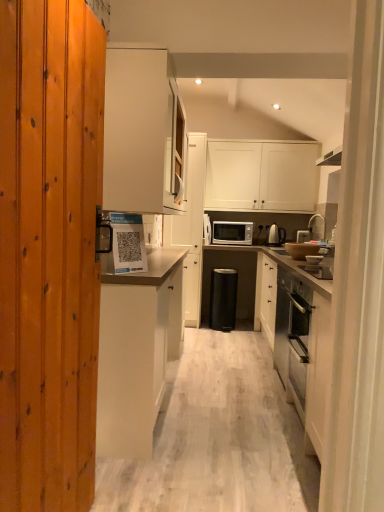
Measure the distance between black plastic trash bin at center and camera.

The distance of black plastic trash bin at center from camera is 14.47 feet.

This screenshot has width=384, height=512. I want to click on white glossy cabinet at upper center, which is the 3th cabinetry in left-to-right order, so click(x=191, y=228).

Image resolution: width=384 pixels, height=512 pixels. What do you see at coordinates (317, 227) in the screenshot?
I see `silver metallic faucet at upper right` at bounding box center [317, 227].

Find the location of `silver metallic faucet at upper right`. silver metallic faucet at upper right is located at coordinates (317, 227).

Based on the photo, measure the distance between point (122, 283) and camera.

A distance of 6.52 feet exists between point (122, 283) and camera.

Identify the location of matte silver teapot at right. (275, 234).

Can you tell me how much white glossy microwave oven at center and white matte cabinet at center, marked as the 1th cabinetry in a left-to-right arrangement, differ in facing direction?

88.8 degrees separate the facing orientations of white glossy microwave oven at center and white matte cabinet at center, marked as the 1th cabinetry in a left-to-right arrangement.

Does white glossy microwave oven at center turn towards white matte cabinet at center, which is counted as the 4th cabinetry, starting from the right?

Yes, white glossy microwave oven at center is turned towards white matte cabinet at center, which is counted as the 4th cabinetry, starting from the right.

From the image's perspective, is white glossy microwave oven at center located above white matte cabinet at center, marked as the 1th cabinetry in a left-to-right arrangement?

Indeed, from the image's perspective, white glossy microwave oven at center is shown above white matte cabinet at center, marked as the 1th cabinetry in a left-to-right arrangement.

Which is correct: white glossy microwave oven at center is inside white matte cabinet at center, which is counted as the 4th cabinetry, starting from the right, or outside of it?

white glossy microwave oven at center cannot be found inside white matte cabinet at center, which is counted as the 4th cabinetry, starting from the right.

Could you tell me if white matte cabinet at center, which is counted as the 4th cabinetry, starting from the right, is facing white glossy microwave oven at center?

No, white matte cabinet at center, which is counted as the 4th cabinetry, starting from the right, is not aimed at white glossy microwave oven at center.

At what (x,y) coordinates should I click in order to perform the action: click on microwave oven above the white matte cabinet at center, marked as the 1th cabinetry in a left-to-right arrangement (from the image's perspective). Please return your answer as a coordinate pair (x, y). Image resolution: width=384 pixels, height=512 pixels. Looking at the image, I should click on (232, 233).

Could you measure the distance between white matte cabinet at center, marked as the 1th cabinetry in a left-to-right arrangement, and white glossy microwave oven at center?

white matte cabinet at center, marked as the 1th cabinetry in a left-to-right arrangement, and white glossy microwave oven at center are 7.78 feet apart from each other.

Considering the positions of point (97, 440) and point (228, 234), is point (97, 440) closer or farther from the camera than point (228, 234)?

Point (97, 440) is positioned closer to the camera compared to point (228, 234).

Where is `faucet below the white glossy cabinet at upper center, which is the 3th cabinetry in left-to-right order (from the image's perspective)`? faucet below the white glossy cabinet at upper center, which is the 3th cabinetry in left-to-right order (from the image's perspective) is located at coordinates (317, 227).

Do you think silver metallic faucet at upper right is within white glossy cabinet at upper center, which is the 3th cabinetry in left-to-right order, or outside of it?

silver metallic faucet at upper right cannot be found inside white glossy cabinet at upper center, which is the 3th cabinetry in left-to-right order.

Does silver metallic faucet at upper right turn towards white glossy cabinet at upper center, which is the 3th cabinetry in left-to-right order?

No, silver metallic faucet at upper right is not facing towards white glossy cabinet at upper center, which is the 3th cabinetry in left-to-right order.

From a real-world perspective, which object rests below the other?

white glossy cabinet at upper center, which is the 3th cabinetry in left-to-right order, is physically lower.

Could you measure the distance between white glossy microwave oven at center and white matte cabinet at upper center, which appears as the 4th cabinetry when viewed from the left?

The distance of white glossy microwave oven at center from white matte cabinet at upper center, which appears as the 4th cabinetry when viewed from the left, is 21.77 inches.

Between white glossy microwave oven at center and white matte cabinet at upper center, which appears as the 4th cabinetry when viewed from the left, which one has more height?

white matte cabinet at upper center, which appears as the 4th cabinetry when viewed from the left.

Where is `microwave oven that is on the left side of white matte cabinet at upper center, acting as the 1th cabinetry starting from the right`? Image resolution: width=384 pixels, height=512 pixels. microwave oven that is on the left side of white matte cabinet at upper center, acting as the 1th cabinetry starting from the right is located at coordinates (232, 233).

Which is behind, white glossy microwave oven at center or white matte cabinet at upper center, which appears as the 4th cabinetry when viewed from the left?

white glossy microwave oven at center is further away from the camera.

This screenshot has height=512, width=384. Identify the location of appliance below the white matte cabinet at upper center, acting as the 1th cabinetry starting from the right (from a real-world perspective). (302, 236).

From a real-world perspective, is satin silver toaster at center under white matte cabinet at upper center, which appears as the 4th cabinetry when viewed from the left?

Correct, in the physical world, satin silver toaster at center is lower than white matte cabinet at upper center, which appears as the 4th cabinetry when viewed from the left.

Between point (299, 238) and point (290, 181), which one is positioned behind?

Positioned behind is point (290, 181).

Consider the image. Could white matte cabinet at upper center, which appears as the 4th cabinetry when viewed from the left, be considered to be inside satin silver toaster at center?

No, white matte cabinet at upper center, which appears as the 4th cabinetry when viewed from the left, is not a part of satin silver toaster at center.

Is white matte cabinet at upper center, which appears as the 4th cabinetry when viewed from the left, wider than silver metallic faucet at upper right?

Yes, white matte cabinet at upper center, which appears as the 4th cabinetry when viewed from the left, is wider than silver metallic faucet at upper right.

Is silver metallic faucet at upper right a part of white matte cabinet at upper center, acting as the 1th cabinetry starting from the right?

No, silver metallic faucet at upper right is not inside white matte cabinet at upper center, acting as the 1th cabinetry starting from the right.

From the image's perspective, between white matte cabinet at upper center, which appears as the 4th cabinetry when viewed from the left, and silver metallic faucet at upper right, which one is located above?

white matte cabinet at upper center, which appears as the 4th cabinetry when viewed from the left, is shown above in the image.

Which is in front, point (313, 200) or point (323, 238)?

The point (323, 238) is closer to the camera.

How many degrees apart are the facing directions of silver metallic faucet at upper right and matte silver teapot at right?

The facing directions of silver metallic faucet at upper right and matte silver teapot at right are 90.2 degrees apart.

Between silver metallic faucet at upper right and matte silver teapot at right, which one appears on the right side from the viewer's perspective?

silver metallic faucet at upper right.

Which of these two, silver metallic faucet at upper right or matte silver teapot at right, is wider?

silver metallic faucet at upper right.

Where is `cabinetry below the white glossy microwave oven at center (from the image's perspective)`? This screenshot has height=512, width=384. cabinetry below the white glossy microwave oven at center (from the image's perspective) is located at coordinates (137, 350).

I want to click on microwave oven located behind the white matte cabinet at center, which is counted as the 4th cabinetry, starting from the right, so click(x=232, y=233).

When comparing their distances from white matte cabinet at upper center, acting as the 1th cabinetry starting from the right, does satin silver toaster at center or silver metallic faucet at upper right seem closer?

The object closer to white matte cabinet at upper center, acting as the 1th cabinetry starting from the right, is silver metallic faucet at upper right.

Estimate the real-world distances between objects in this image. Which object is closer to matte silver teapot at right, white matte cabinet at upper center, acting as the 1th cabinetry starting from the right, or white matte cabinet at upper center, the 2th cabinetry positioned from the left?

white matte cabinet at upper center, acting as the 1th cabinetry starting from the right, is closer to matte silver teapot at right.

Looking at this image, considering their positions, is white matte cabinet at center, which is counted as the 4th cabinetry, starting from the right, positioned further to silver metallic faucet at upper right than matte silver teapot at right?

The object further to silver metallic faucet at upper right is white matte cabinet at center, which is counted as the 4th cabinetry, starting from the right.

Estimate the real-world distances between objects in this image. Which object is closer to white matte cabinet at center, which is counted as the 4th cabinetry, starting from the right, white glossy microwave oven at center or white glossy cabinet at upper center, arranged as the 2th cabinetry when viewed from the right?

white glossy cabinet at upper center, arranged as the 2th cabinetry when viewed from the right, is positioned closer to the anchor white matte cabinet at center, which is counted as the 4th cabinetry, starting from the right.

When comparing their distances from white glossy cabinet at upper center, arranged as the 2th cabinetry when viewed from the right, does black plastic trash bin at center or white matte cabinet at center, which is counted as the 4th cabinetry, starting from the right, seem closer?

Based on the image, black plastic trash bin at center appears to be nearer to white glossy cabinet at upper center, arranged as the 2th cabinetry when viewed from the right.

In the scene shown: Considering their positions, is white glossy microwave oven at center positioned further to matte silver teapot at right than white matte cabinet at center, which is counted as the 4th cabinetry, starting from the right?

The object further to matte silver teapot at right is white matte cabinet at center, which is counted as the 4th cabinetry, starting from the right.

Considering their positions, is white matte cabinet at upper center, acting as the 1th cabinetry starting from the right, positioned further to black plastic trash bin at center than white glossy cabinet at upper center, which is the 3th cabinetry in left-to-right order?

white matte cabinet at upper center, acting as the 1th cabinetry starting from the right, is further to black plastic trash bin at center.

Based on the photo, estimate the real-world distances between objects in this image. Which object is closer to white matte cabinet at center, marked as the 1th cabinetry in a left-to-right arrangement, satin silver toaster at center or white glossy microwave oven at center?

white glossy microwave oven at center is closer to white matte cabinet at center, marked as the 1th cabinetry in a left-to-right arrangement.

You are a GUI agent. You are given a task and a screenshot of the screen. Output one action in this format:
    pyautogui.click(x=<x>, y=<y>)
    Task: Click on the cabinetry between white matte cabinet at center, marked as the 1th cabinetry in a left-to-right arrangement, and satin silver toaster at center from front to back
    This screenshot has height=512, width=384.
    Given the screenshot: What is the action you would take?
    pyautogui.click(x=191, y=228)

The height and width of the screenshot is (512, 384). I want to click on appliance between silver metallic faucet at upper right and matte silver teapot at right from front to back, so 302,236.

Locate an element on the screen. This screenshot has height=512, width=384. trash bin/can between white matte cabinet at upper center, acting as the 3th cabinetry starting from the right, and white matte cabinet at upper center, acting as the 1th cabinetry starting from the right, along the z-axis is located at coordinates (223, 298).

Where is `faucet between white matte cabinet at upper center, acting as the 3th cabinetry starting from the right, and white glossy cabinet at upper center, which is the 3th cabinetry in left-to-right order, from front to back`? Image resolution: width=384 pixels, height=512 pixels. faucet between white matte cabinet at upper center, acting as the 3th cabinetry starting from the right, and white glossy cabinet at upper center, which is the 3th cabinetry in left-to-right order, from front to back is located at coordinates (317, 227).